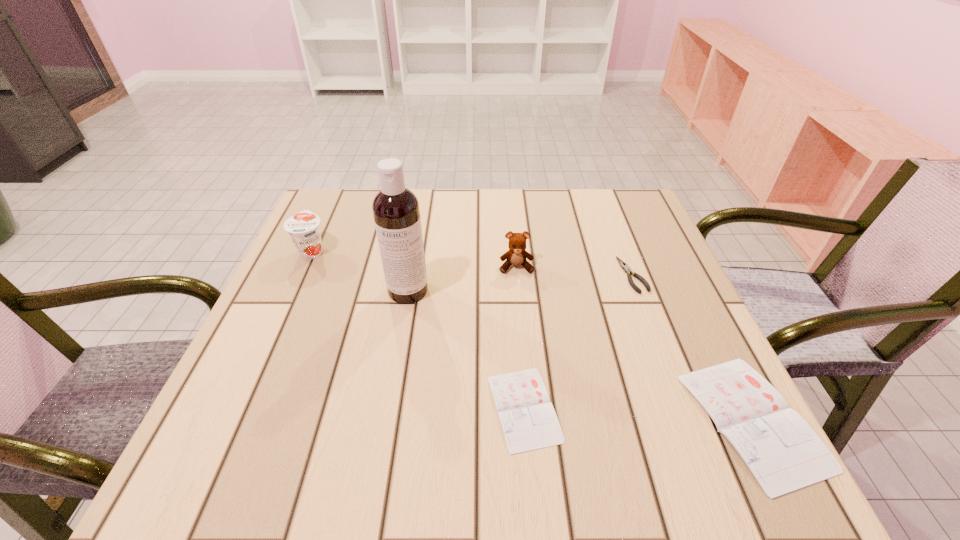
Find the location of a particular element. Image resolution: width=960 pixels, height=540 pixels. vacant point located 0.110m on the back of the right diary is located at coordinates (701, 316).

Where is `blank space located 0.060m on the front of the yogurt`? This screenshot has width=960, height=540. blank space located 0.060m on the front of the yogurt is located at coordinates (299, 280).

Identify the location of free space located 0.160m on the label side of the tallest object. The width and height of the screenshot is (960, 540). (395, 367).

Find the location of a particular element. This screenshot has height=540, width=960. free space located on the left of the second shortest object is located at coordinates (551, 275).

Find the location of a particular element. blank space located 0.330m on the front-facing side of the teddy bear is located at coordinates (529, 402).

Where is `object that is at the far edge`? object that is at the far edge is located at coordinates (303, 228).

Find the location of a particular element. This screenshot has height=540, width=960. object that is positioned at the left edge is located at coordinates (303, 228).

This screenshot has width=960, height=540. In order to click on diary at the right edge in this screenshot , I will do `click(783, 452)`.

Where is `pliers at the right edge`? The width and height of the screenshot is (960, 540). pliers at the right edge is located at coordinates (623, 265).

At what (x,y) coordinates should I click in order to perform the action: click on object situated at the far left corner. Please return your answer as a coordinate pair (x, y). Looking at the image, I should click on (303, 228).